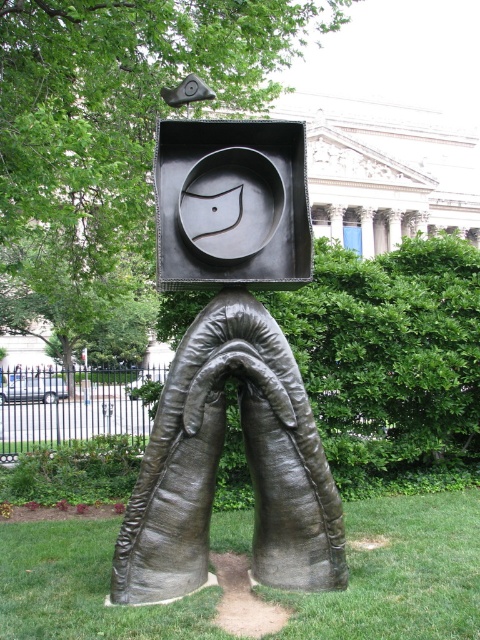
Question: Is bronze sculpture at center closer to the viewer compared to green grass at lower center?

Choices:
 (A) no
 (B) yes

Answer: (B)

Question: Is the position of bronze sculpture at center less distant than that of green grass at lower center?

Choices:
 (A) no
 (B) yes

Answer: (B)

Question: Which point is farther from the camera taking this photo?

Choices:
 (A) (261, 529)
 (B) (429, 588)

Answer: (A)

Question: Which point is farther to the camera?

Choices:
 (A) (204, 340)
 (B) (408, 541)

Answer: (B)

Question: Can you confirm if bronze sculpture at center is wider than green grass at lower center?

Choices:
 (A) yes
 (B) no

Answer: (A)

Question: Which point is farther from the camera taking this photo?

Choices:
 (A) [x=163, y=616]
 (B) [x=286, y=545]

Answer: (B)